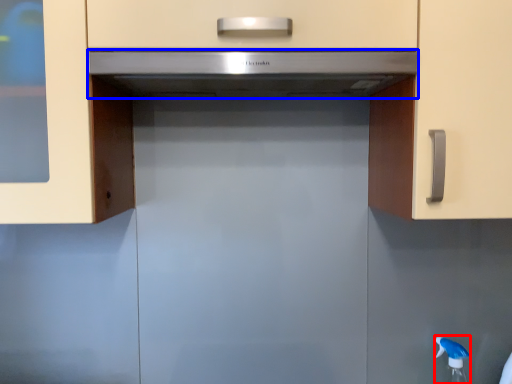
Question: Which point is closer to the camera, faucet (highlighted by a red box) or home appliance (highlighted by a blue box)?

Choices:
 (A) faucet
 (B) home appliance

Answer: (B)